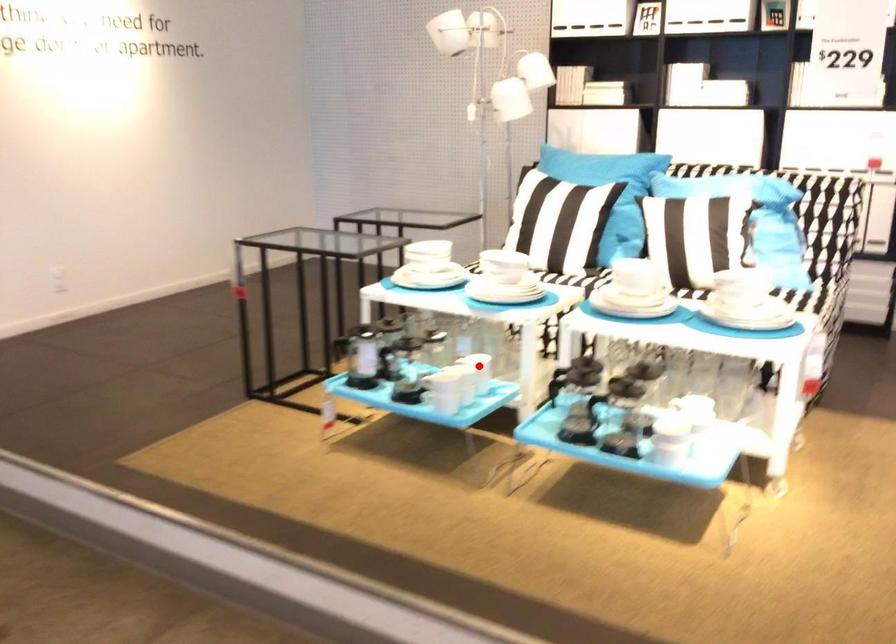
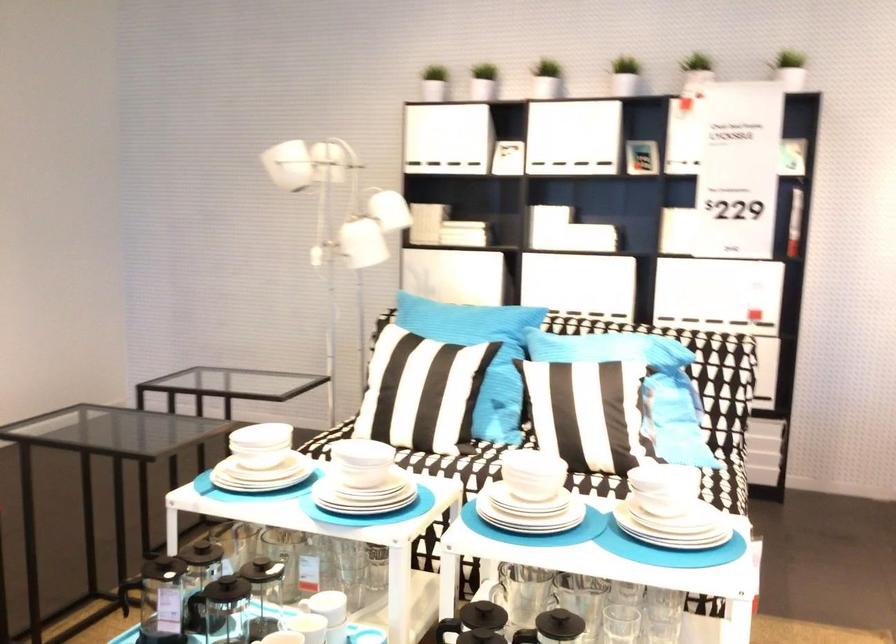
Question: I am providing you with two images of the same scene from different viewpoints. A red point is shown in image1. For the corresponding object point in image2, is it positioned nearer or farther from the camera?

Choices:
 (A) Nearer
 (B) Farther

Answer: (A)